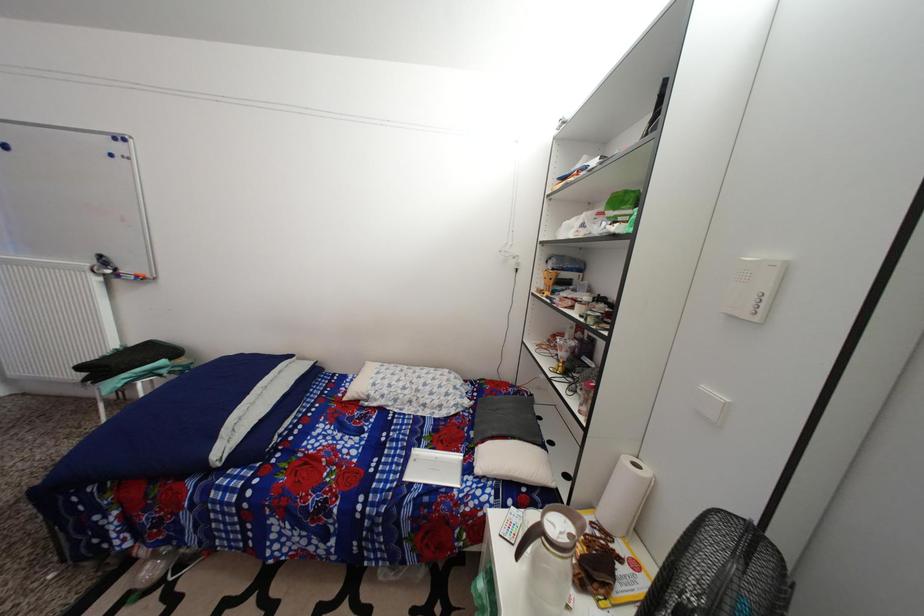
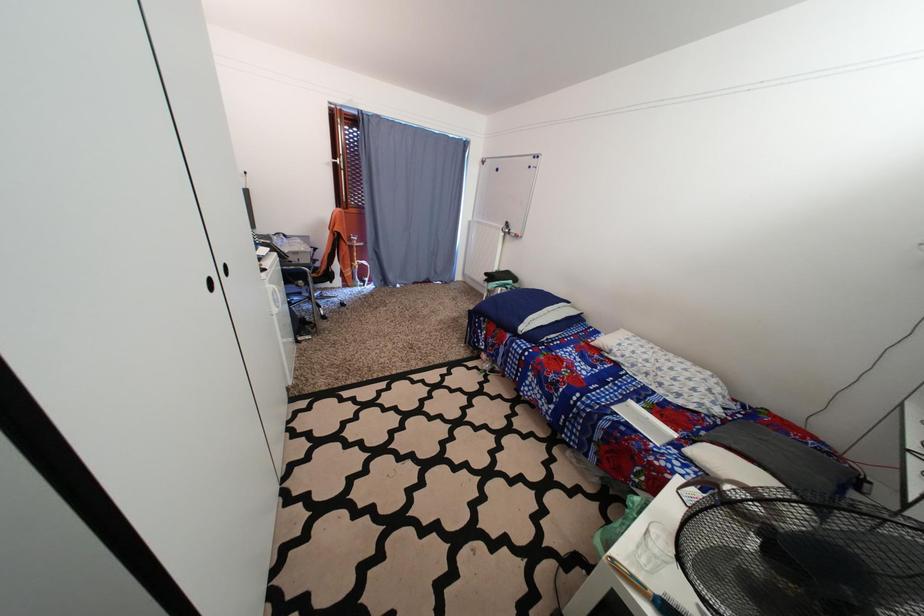
Question: The camera is either moving clockwise (left) or counter-clockwise (right) around the object. The first image is from the beginning of the video and the second image is from the end. Is the camera moving left or right when shooting the video?

Choices:
 (A) Left
 (B) Right

Answer: (B)